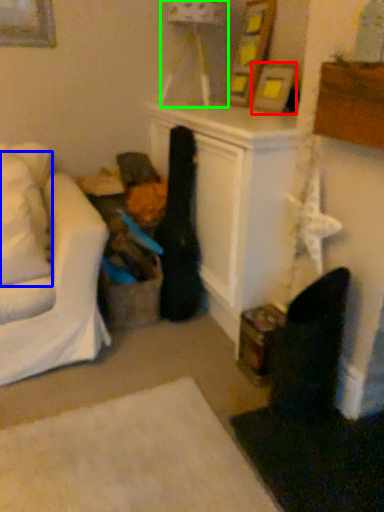
Question: Which object is the farthest from picture frame (highlighted by a red box)? Choose among these: pillow (highlighted by a blue box) or lamp (highlighted by a green box).

Choices:
 (A) pillow
 (B) lamp

Answer: (A)